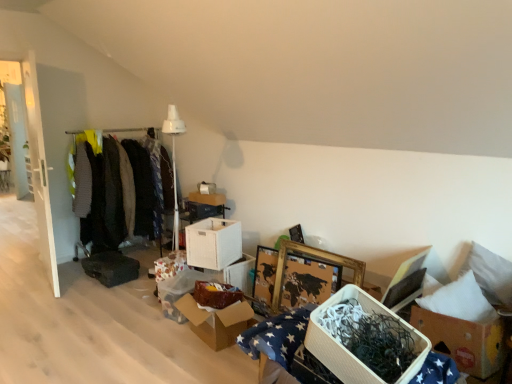
Question: Is cardboard box at center, which ranks as the 2th cardboard box in right-to-left order, taller than white cardboard box at center, arranged as the fourth storage box when viewed from the back?

Choices:
 (A) no
 (B) yes

Answer: (B)

Question: From a real-world perspective, is cardboard box at center, which ranks as the 2th cardboard box in right-to-left order, physically below white cardboard box at center, the 3th storage box viewed from the front?

Choices:
 (A) yes
 (B) no

Answer: (A)

Question: Would you say cardboard box at center, the 1th cardboard box viewed from the left, is a long distance from white cardboard box at center, arranged as the fourth storage box when viewed from the back?

Choices:
 (A) no
 (B) yes

Answer: (A)

Question: Is cardboard box at center, the 1th cardboard box viewed from the left, completely or partially outside of white cardboard box at center, the 3th storage box viewed from the front?

Choices:
 (A) yes
 (B) no

Answer: (A)

Question: Could you tell me if cardboard box at center, which ranks as the 2th cardboard box in right-to-left order, is facing white cardboard box at center, the 3th storage box viewed from the front?

Choices:
 (A) no
 (B) yes

Answer: (A)

Question: Can you see cardboard box at center, the 1th cardboard box viewed from the left, touching white cardboard box at center, the 3th storage box viewed from the front?

Choices:
 (A) no
 (B) yes

Answer: (A)

Question: Is the depth of white cardboard storage box at center, positioned as the sixth storage box in front-to-back order, greater than that of knit sweater at left, which is the second clothing in right-to-left order?

Choices:
 (A) no
 (B) yes

Answer: (A)

Question: Is white cardboard storage box at center, positioned as the sixth storage box in front-to-back order, facing towards knit sweater at left, which is the second clothing in right-to-left order?

Choices:
 (A) no
 (B) yes

Answer: (A)

Question: Considering the relative sizes of white cardboard storage box at center, positioned as the sixth storage box in front-to-back order, and knit sweater at left, marked as the 2th clothing in a left-to-right arrangement, in the image provided, is white cardboard storage box at center, positioned as the sixth storage box in front-to-back order, thinner than knit sweater at left, marked as the 2th clothing in a left-to-right arrangement,?

Choices:
 (A) yes
 (B) no

Answer: (A)

Question: Is white cardboard storage box at center, positioned as the sixth storage box in front-to-back order, to the right of knit sweater at left, marked as the 2th clothing in a left-to-right arrangement, from the viewer's perspective?

Choices:
 (A) no
 (B) yes

Answer: (B)

Question: Does white cardboard storage box at center, marked as the first storage box in a back-to-front arrangement, have a lesser height compared to knit sweater at left, which is the second clothing in right-to-left order?

Choices:
 (A) no
 (B) yes

Answer: (B)

Question: Is white cardboard storage box at center, marked as the first storage box in a back-to-front arrangement, located outside knit sweater at left, marked as the 2th clothing in a left-to-right arrangement?

Choices:
 (A) no
 (B) yes

Answer: (B)

Question: From a real-world perspective, is dark green fabric at left, arranged as the first clothing when viewed from the left, under knit sweater at left, marked as the 2th clothing in a left-to-right arrangement?

Choices:
 (A) yes
 (B) no

Answer: (B)